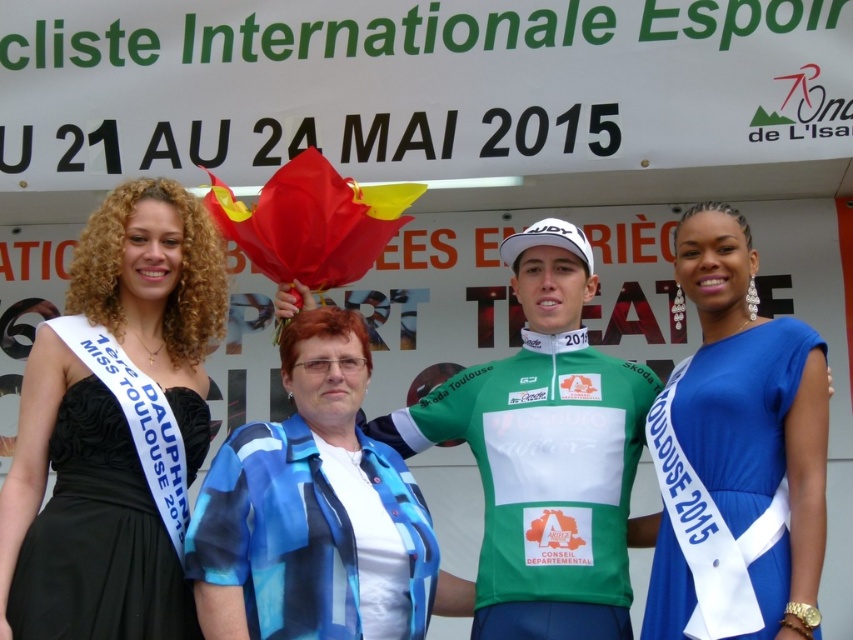
Can you confirm if black satin dress at upper left is positioned to the left of green jersey at center?

Correct, you'll find black satin dress at upper left to the left of green jersey at center.

Which is below, black satin dress at upper left or green jersey at center?

green jersey at center

Between point (165, 531) and point (628, 637), which one is positioned behind?

Positioned behind is point (628, 637).

The width and height of the screenshot is (853, 640). I want to click on black satin dress at upper left, so click(x=82, y=516).

Which is behind, point (44, 627) or point (705, 388)?

Point (705, 388)

Between black satin dress at upper left and blue satin dress at center, which one is positioned lower?

blue satin dress at center is below.

What do you see at coordinates (82, 516) in the screenshot? The width and height of the screenshot is (853, 640). I see `black satin dress at upper left` at bounding box center [82, 516].

You are a GUI agent. You are given a task and a screenshot of the screen. Output one action in this format:
    pyautogui.click(x=<x>, y=<y>)
    Task: Click on the black satin dress at upper left
    This screenshot has width=853, height=640.
    Given the screenshot: What is the action you would take?
    82,516

Where is `green jersey at center`? green jersey at center is located at coordinates (544, 452).